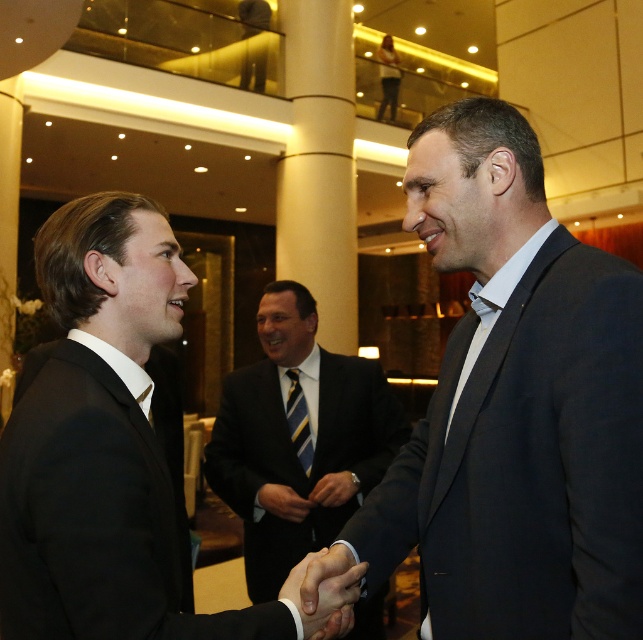
Question: Which object is positioned farthest from the dark gray suit at center?

Choices:
 (A) smooth black hand at center
 (B) striped silk tie at center
 (C) black suit at left
 (D) matte black hand at center

Answer: (B)

Question: Which object appears farthest from the camera in this image?

Choices:
 (A) black suit at left
 (B) smooth black hand at center

Answer: (B)

Question: Where is dark gray suit at center located in relation to striped silk tie at center in the image?

Choices:
 (A) above
 (B) below

Answer: (A)

Question: Can you confirm if black suit at left is wider than dark suit at center?

Choices:
 (A) no
 (B) yes

Answer: (B)

Question: Can you confirm if dark suit at center is positioned below smooth leather hand at center?

Choices:
 (A) yes
 (B) no

Answer: (B)

Question: Which point appears closest to the camera in this image?

Choices:
 (A) (314, 492)
 (B) (291, 513)
 (C) (494, 259)
 (D) (302, 464)

Answer: (C)